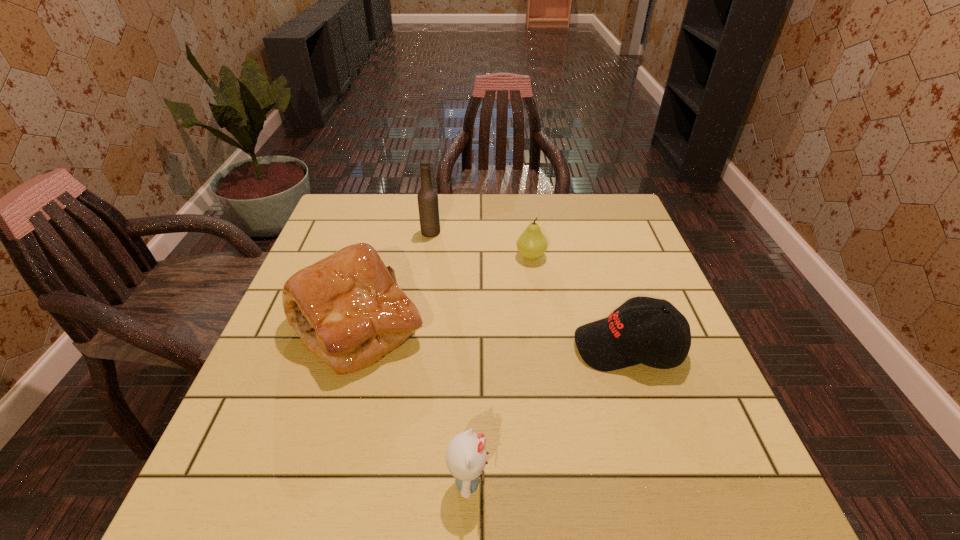
Identify the location of beer bottle. This screenshot has width=960, height=540. (428, 205).

The image size is (960, 540). Identify the location of the farthest object. (428, 205).

Image resolution: width=960 pixels, height=540 pixels. I want to click on the second tallest object, so click(x=347, y=308).

At what (x,y) coordinates should I click in order to perform the action: click on the second object from right to left. Please return your answer as a coordinate pair (x, y). The height and width of the screenshot is (540, 960). Looking at the image, I should click on (531, 244).

Find the location of `pear`. pear is located at coordinates (531, 244).

The width and height of the screenshot is (960, 540). In order to click on the rightmost object in this screenshot , I will do `click(662, 340)`.

Where is `kitten`? This screenshot has height=540, width=960. kitten is located at coordinates (466, 456).

Locate an element on the screen. This screenshot has width=960, height=540. the nearest object is located at coordinates (466, 456).

Locate an element on the screen. free space located on the side of the beer bottle with the label is located at coordinates (543, 232).

Find the location of a particular element. This screenshot has height=540, width=960. free location located on the filling side of the fourth shortest object is located at coordinates (528, 326).